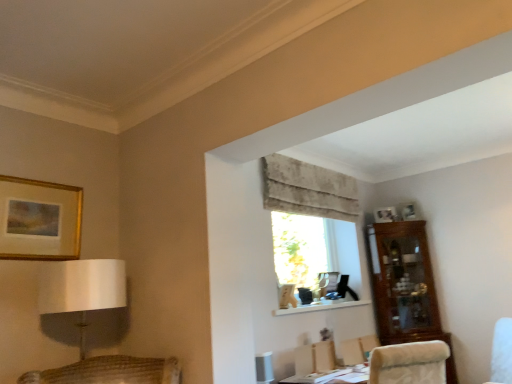
Question: From a real-world perspective, is gold/glossy picture frame at upper left, which appears as the 1th picture frame when viewed from the front, on velvet beige armchair at lower right?

Choices:
 (A) no
 (B) yes

Answer: (B)

Question: Does gold/glossy picture frame at upper left, which is the 3th picture frame from back to front, turn towards velvet beige armchair at lower right?

Choices:
 (A) yes
 (B) no

Answer: (B)

Question: Is gold/glossy picture frame at upper left, which is the third picture frame from right to left, facing away from velvet beige armchair at lower right?

Choices:
 (A) yes
 (B) no

Answer: (B)

Question: Is gold/glossy picture frame at upper left, which appears as the 1th picture frame when viewed from the front, touching velvet beige armchair at lower right?

Choices:
 (A) no
 (B) yes

Answer: (A)

Question: From the image's perspective, is gold/glossy picture frame at upper left, which is the 3th picture frame from back to front, over velvet beige armchair at lower right?

Choices:
 (A) no
 (B) yes

Answer: (B)

Question: From the image's perspective, does gold/glossy picture frame at upper left, which appears as the 1th picture frame when viewed from the front, appear lower than velvet beige armchair at lower right?

Choices:
 (A) yes
 (B) no

Answer: (B)

Question: Is white glossy picture frame at upper right, the 1th picture frame positioned from the right, surrounding translucent fabric window at center?

Choices:
 (A) no
 (B) yes

Answer: (A)

Question: Does white glossy picture frame at upper right, the 1th picture frame positioned from the right, have a greater width compared to translucent fabric window at center?

Choices:
 (A) yes
 (B) no

Answer: (B)

Question: Does white glossy picture frame at upper right, the first picture frame positioned from the back, have a smaller size compared to translucent fabric window at center?

Choices:
 (A) yes
 (B) no

Answer: (A)

Question: Could you tell me if white glossy picture frame at upper right, arranged as the third picture frame when viewed from the left, is facing translucent fabric window at center?

Choices:
 (A) yes
 (B) no

Answer: (B)

Question: From the image's perspective, is white glossy picture frame at upper right, arranged as the third picture frame when viewed from the left, on translucent fabric window at center?

Choices:
 (A) no
 (B) yes

Answer: (B)

Question: From a real-world perspective, is white glossy picture frame at upper right, positioned as the third picture frame in front-to-back order, located higher than translucent fabric window at center?

Choices:
 (A) yes
 (B) no

Answer: (A)

Question: Is gold/glossy picture frame at upper left, marked as the 1th picture frame in a left-to-right arrangement, positioned behind beige textured curtain at upper center?

Choices:
 (A) no
 (B) yes

Answer: (A)